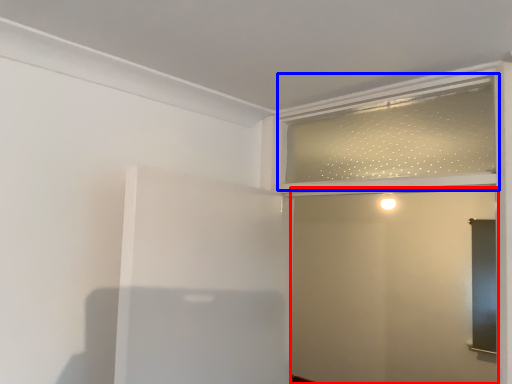
Question: Which object is closer to the camera taking this photo, screen door (highlighted by a red box) or window frame (highlighted by a blue box)?

Choices:
 (A) screen door
 (B) window frame

Answer: (A)